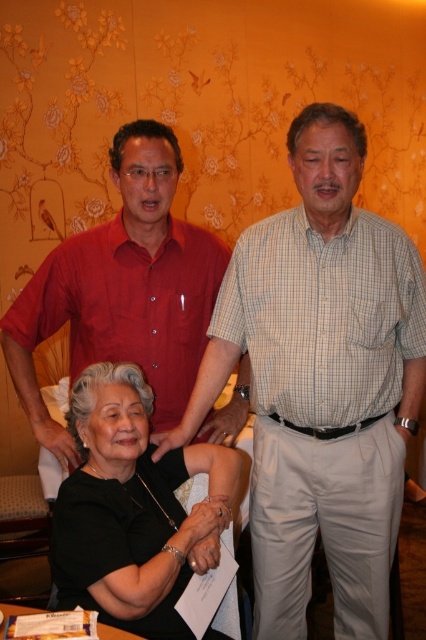
Does point (319, 435) come in front of point (63, 486)?

No.

Is light blue checkered shirt at center closer to camera compared to black matte shirt at center?

That is False.

The image size is (426, 640). What do you see at coordinates (321, 381) in the screenshot?
I see `light blue checkered shirt at center` at bounding box center [321, 381].

Where is `light blue checkered shirt at center`? The image size is (426, 640). light blue checkered shirt at center is located at coordinates (321, 381).

Which is in front, point (265, 524) or point (150, 124)?

Point (265, 524)

Is point (250, 301) farther from camera compared to point (54, 320)?

No.

Image resolution: width=426 pixels, height=640 pixels. I want to click on light blue checkered shirt at center, so click(x=321, y=381).

Which is more to the left, light blue checkered shirt at center or white paper at lower center?

Positioned to the left is white paper at lower center.

Is light blue checkered shirt at center further to camera compared to white paper at lower center?

Yes, light blue checkered shirt at center is further from the viewer.

Where is `light blue checkered shirt at center`? light blue checkered shirt at center is located at coordinates (321, 381).

Find the location of a particular element. light blue checkered shirt at center is located at coordinates (321, 381).